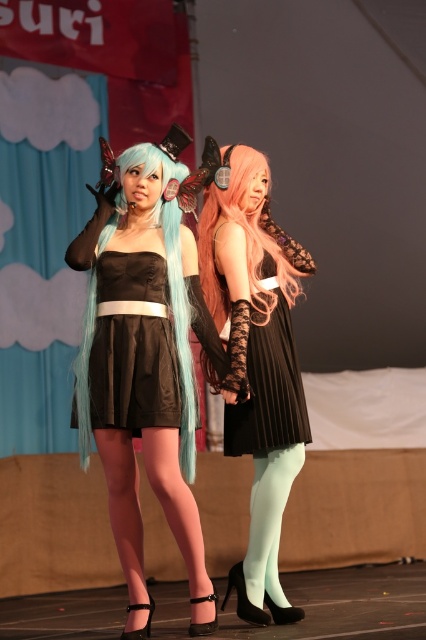
You are a photographer setting up for a photoshoot. You need to ensure that the black pleated dress at center and the light blue silky tights at lower center are both visible in the frame. Based on their positions, which object is covering part of the other?

The black pleated dress at center is positioned over the light blue silky tights at lower center, so the dress is covering part of the silky tights.

You are a photographer positioned at the back of the stage. You want to capture a photo where both the satin black dress at center and the black pleated dress at center are clearly visible. Based on their positions, which dress should you focus on first to ensure the other is also in the frame?

The satin black dress at center is in front of the black pleated dress at center. To ensure both are clearly visible, focus on the black pleated dress at center first, as it is behind the satin black dress at center and will remain in the frame when the foreground dress is properly positioned.